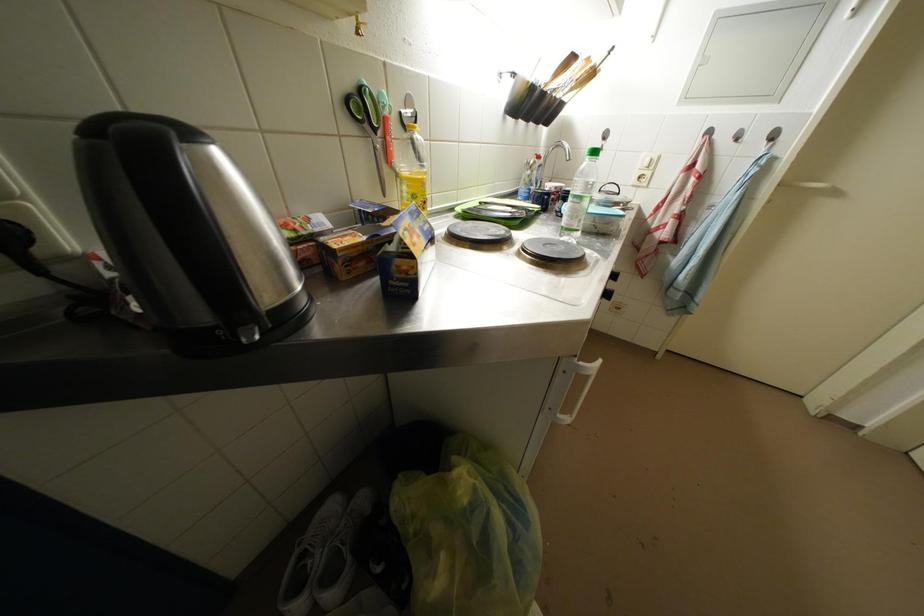
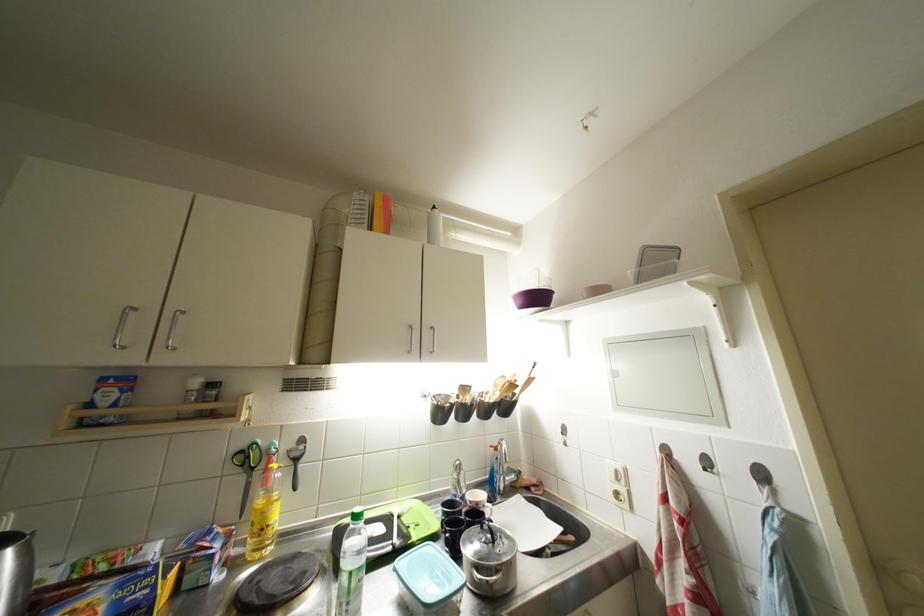
In the second image, find the point that corresponds to (355,89) in the first image.

(249, 450)